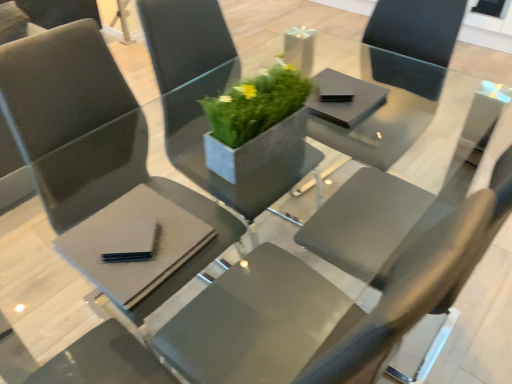
Question: Which direction should I rotate to look at matte gray chair at center, placed as the 1th chair when sorted from left to right?

Choices:
 (A) right
 (B) left

Answer: (B)

Question: Does black matte pad at lower left, acting as the first pad starting from the front, appear on the right side of matte black table at center?

Choices:
 (A) yes
 (B) no

Answer: (B)

Question: Can you confirm if black matte pad at lower left, which appears as the first pad when viewed from the left, is bigger than matte black table at center?

Choices:
 (A) no
 (B) yes

Answer: (A)

Question: Does black matte pad at lower left, which appears as the first pad when viewed from the left, appear on the left side of matte black table at center?

Choices:
 (A) yes
 (B) no

Answer: (A)

Question: Is black matte pad at lower left, which appears as the first pad when viewed from the left, thinner than matte black table at center?

Choices:
 (A) yes
 (B) no

Answer: (A)

Question: From a real-world perspective, is black matte pad at lower left, acting as the first pad starting from the front, over matte black table at center?

Choices:
 (A) no
 (B) yes

Answer: (B)

Question: Is black matte pad at lower left, acting as the first pad starting from the front, oriented away from matte black table at center?

Choices:
 (A) yes
 (B) no

Answer: (B)

Question: Is matte gray chair at center, placed as the first chair when sorted from right to left, positioned in front of black matte napkin at center, the 1th pad from the top?

Choices:
 (A) yes
 (B) no

Answer: (A)

Question: Can you confirm if matte gray chair at center, the 2th chair from the left, is positioned to the right of black matte napkin at center, the 1th pad from the back?

Choices:
 (A) yes
 (B) no

Answer: (B)

Question: Is the surface of matte gray chair at center, placed as the first chair when sorted from right to left, in direct contact with black matte napkin at center, marked as the first pad in a right-to-left arrangement?

Choices:
 (A) no
 (B) yes

Answer: (A)

Question: Is black matte napkin at center, which is the second pad in bottom-to-top order, surrounded by matte gray chair at center, placed as the first chair when sorted from right to left?

Choices:
 (A) yes
 (B) no

Answer: (B)

Question: Does matte gray chair at center, placed as the first chair when sorted from right to left, have a greater width compared to black matte napkin at center, the 1th pad from the back?

Choices:
 (A) no
 (B) yes

Answer: (B)

Question: Is matte gray chair at center, placed as the first chair when sorted from right to left, further to camera compared to black matte napkin at center, the 1th pad from the top?

Choices:
 (A) yes
 (B) no

Answer: (B)

Question: Is black matte pad at lower left, which appears as the first pad when viewed from the left, to the right of black matte napkin at center, which is the second pad in left-to-right order, from the viewer's perspective?

Choices:
 (A) yes
 (B) no

Answer: (B)